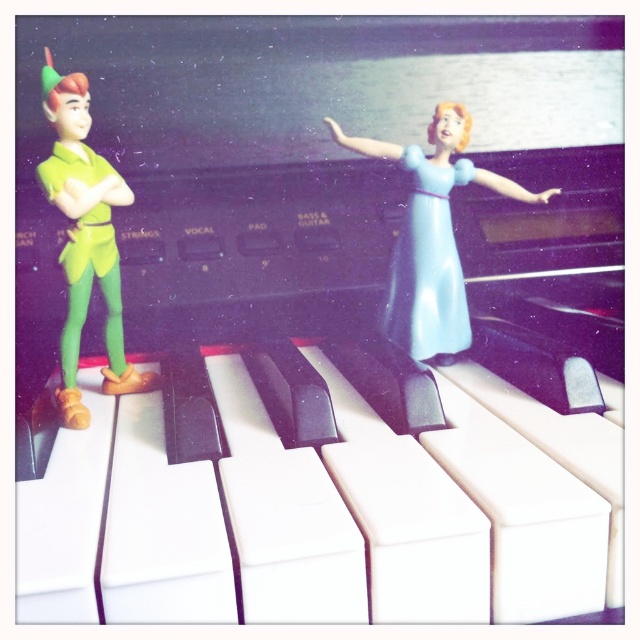
Does light blue plastic figure at center have a greater height compared to light blue plastic dress at center?

Yes, light blue plastic figure at center is taller than light blue plastic dress at center.

What are the coordinates of `light blue plastic figure at center` in the screenshot? It's located at (432, 236).

Identify the location of light blue plastic figure at center. The height and width of the screenshot is (640, 640). (432, 236).

This screenshot has width=640, height=640. Identify the location of light blue plastic figure at center. (432, 236).

How much distance is there between light blue plastic figure at center and green matte peter pan figurine at left?

They are 36.20 centimeters apart.

Which is behind, point (451, 332) or point (92, 269)?

Point (451, 332)

Where is `light blue plastic figure at center`? This screenshot has width=640, height=640. light blue plastic figure at center is located at coordinates (432, 236).

Which is more to the left, green matte peter pan figurine at left or light blue plastic dress at center?

From the viewer's perspective, green matte peter pan figurine at left appears more on the left side.

The image size is (640, 640). Describe the element at coordinates (84, 240) in the screenshot. I see `green matte peter pan figurine at left` at that location.

You are a GUI agent. You are given a task and a screenshot of the screen. Output one action in this format:
    pyautogui.click(x=<x>, y=<y>)
    Task: Click on the green matte peter pan figurine at left
    The height and width of the screenshot is (640, 640).
    Given the screenshot: What is the action you would take?
    pyautogui.click(x=84, y=240)